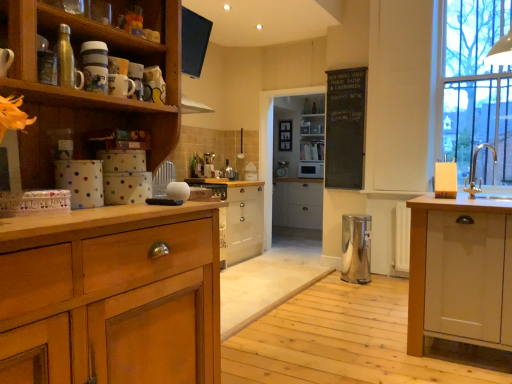
Image resolution: width=512 pixels, height=384 pixels. Identify the location of free location to the left of polished stainless steel trash can at center, which ranks as the 1th appliance in right-to-left order. (325, 282).